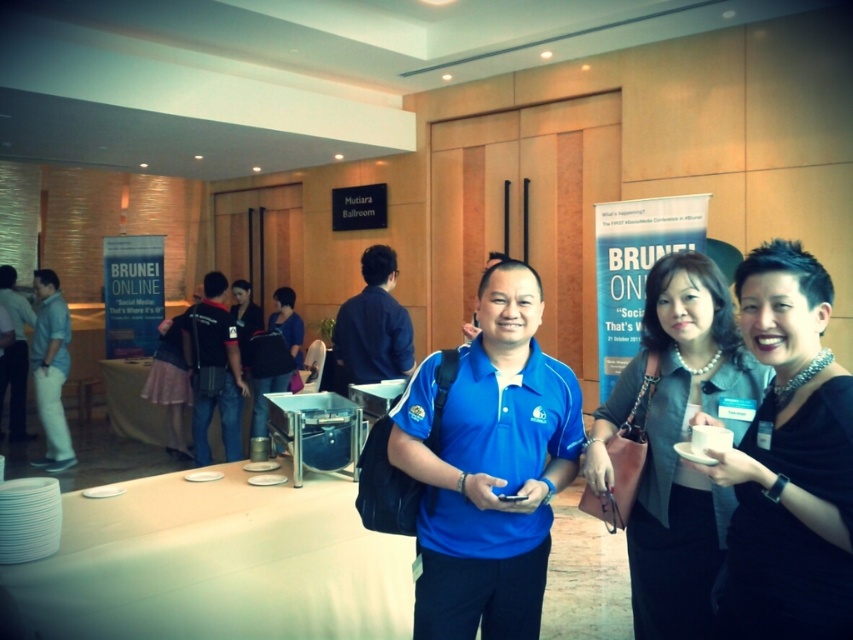
Please look at the two shirts in the image. The dark blue shirt at center and the blue fabric shirt at center. Which one is wider?

The dark blue shirt at center is wider than the blue fabric shirt at center.